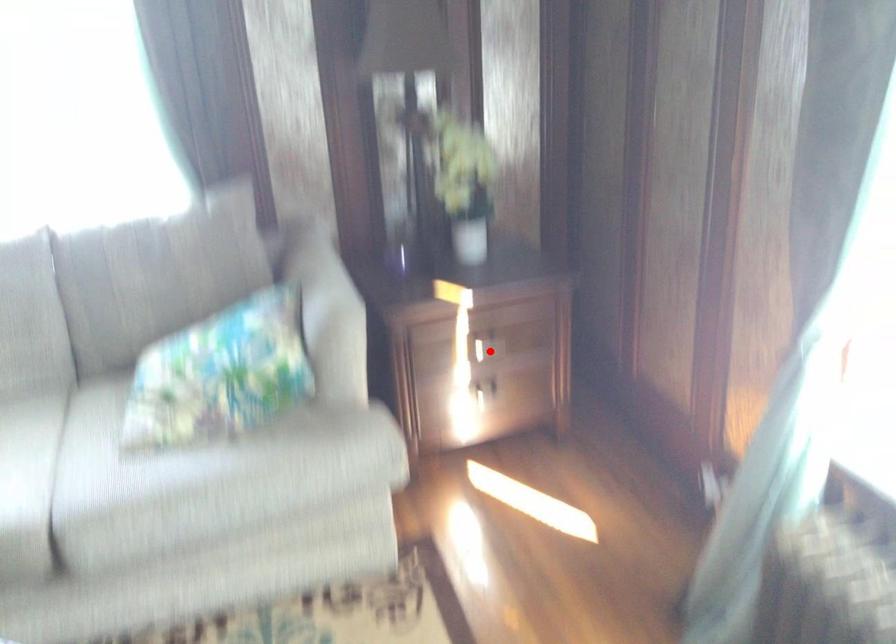
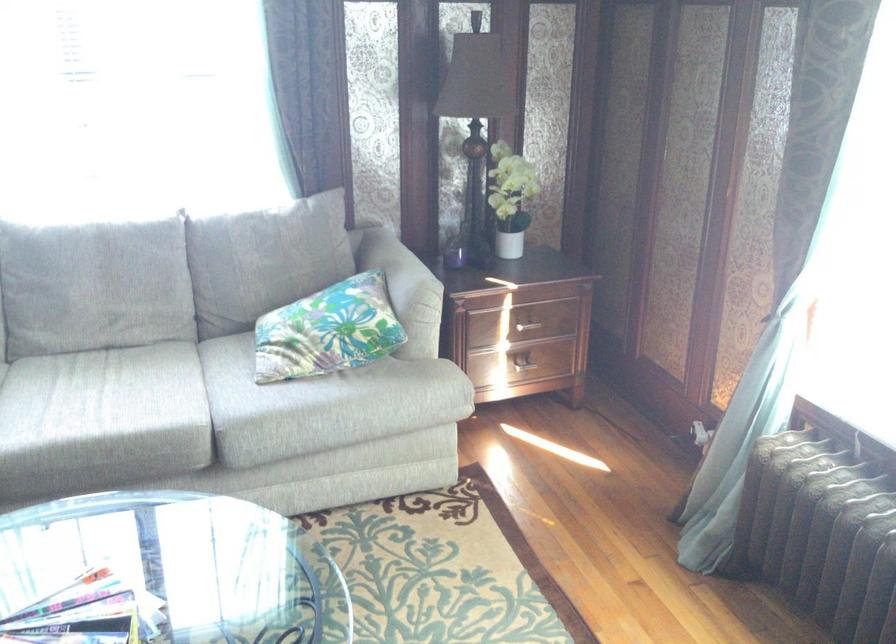
Where in the second image is the point corresponding to the highlighted location from the first image?

(526, 327)